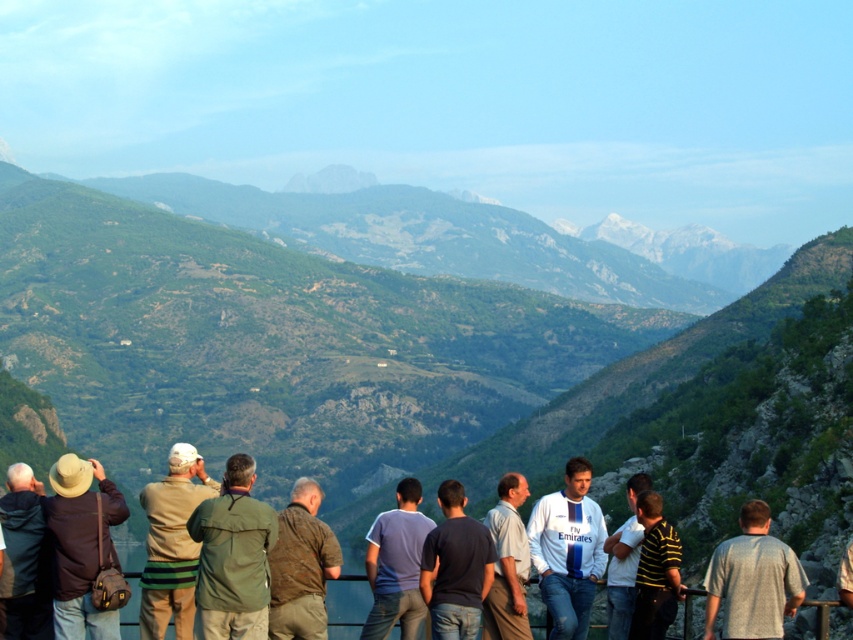
Which of these two, dark blue t-shirt at center or light gray shirt at center, stands shorter?

dark blue t-shirt at center is shorter.

Who is higher up, dark blue t-shirt at center or light gray shirt at center?

dark blue t-shirt at center is above.

Between point (434, 580) and point (498, 566), which one is positioned behind?

The point (498, 566) is more distant.

At what (x,y) coordinates should I click in order to perform the action: click on dark blue t-shirt at center. Please return your answer as a coordinate pair (x, y). The image size is (853, 640). Looking at the image, I should click on (456, 566).

Measure the distance between brown textured jacket at center and blue cotton shirt at center.

brown textured jacket at center is 149.60 feet from blue cotton shirt at center.

Which is below, brown textured jacket at center or blue cotton shirt at center?

Positioned lower is blue cotton shirt at center.

Which is behind, point (335, 541) or point (421, 534)?

Positioned behind is point (421, 534).

This screenshot has width=853, height=640. What are the coordinates of `brown textured jacket at center` in the screenshot? It's located at (300, 566).

Does matte brown hat at left come behind dark blue t-shirt at center?

No.

Can you confirm if matte brown hat at left is shorter than dark blue t-shirt at center?

Incorrect, matte brown hat at left's height does not fall short of dark blue t-shirt at center's.

Which is in front, point (67, 484) or point (456, 492)?

Positioned in front is point (67, 484).

Image resolution: width=853 pixels, height=640 pixels. Identify the location of matte brown hat at left. (80, 545).